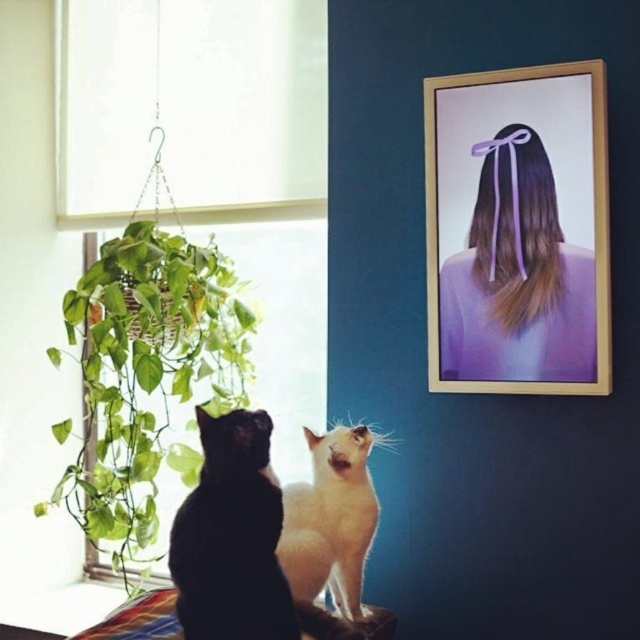
In the scene shown: Is wooden frame at upper right above green leafy plant at left?

Correct, wooden frame at upper right is located above green leafy plant at left.

Is point (589, 284) positioned after point (186, 460)?

No.

At what (x,y) coordinates should I click in order to perform the action: click on wooden frame at upper right. Please return your answer as a coordinate pair (x, y). Looking at the image, I should click on pos(516,230).

Between point (493, 349) and point (310, 435), which one is positioned in front?

Point (310, 435) is more forward.

Does point (451, 312) come closer to viewer compared to point (340, 561)?

That is False.

Locate an element on the screen. This screenshot has height=640, width=640. wooden frame at upper right is located at coordinates click(516, 230).

Is white fabric at upper left shorter than black fur cat at lower left?

No.

Does white fabric at upper left appear on the left side of black fur cat at lower left?

Indeed, white fabric at upper left is positioned on the left side of black fur cat at lower left.

The image size is (640, 640). Find the location of `white fabric at upper left`. white fabric at upper left is located at coordinates (189, 104).